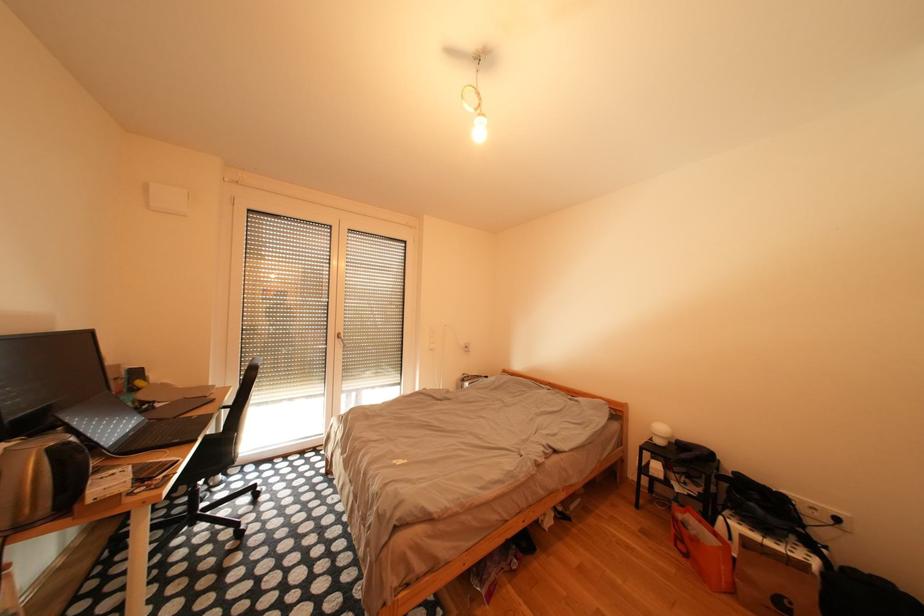
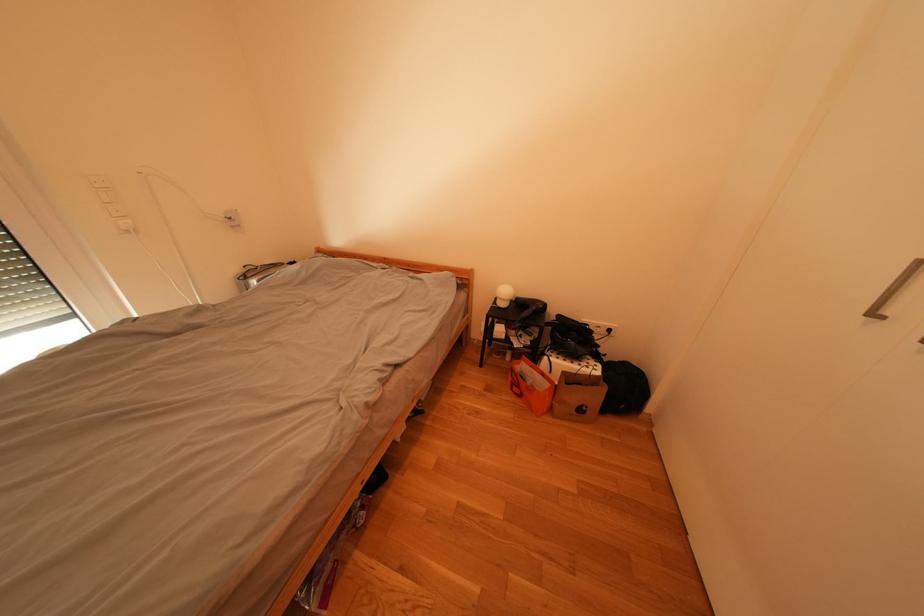
First-person continuous shooting, in which direction is the camera rotating?

The camera rotated toward right-down.